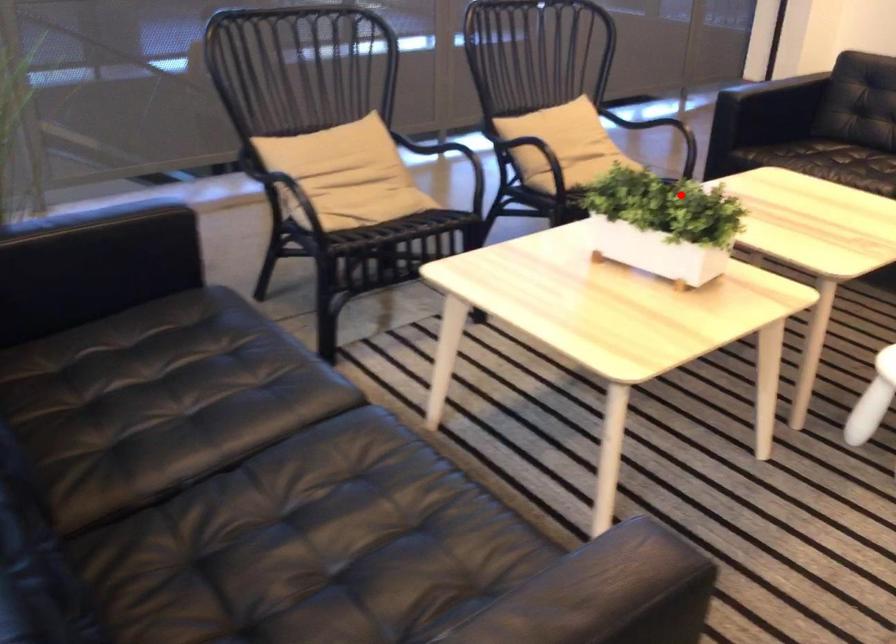
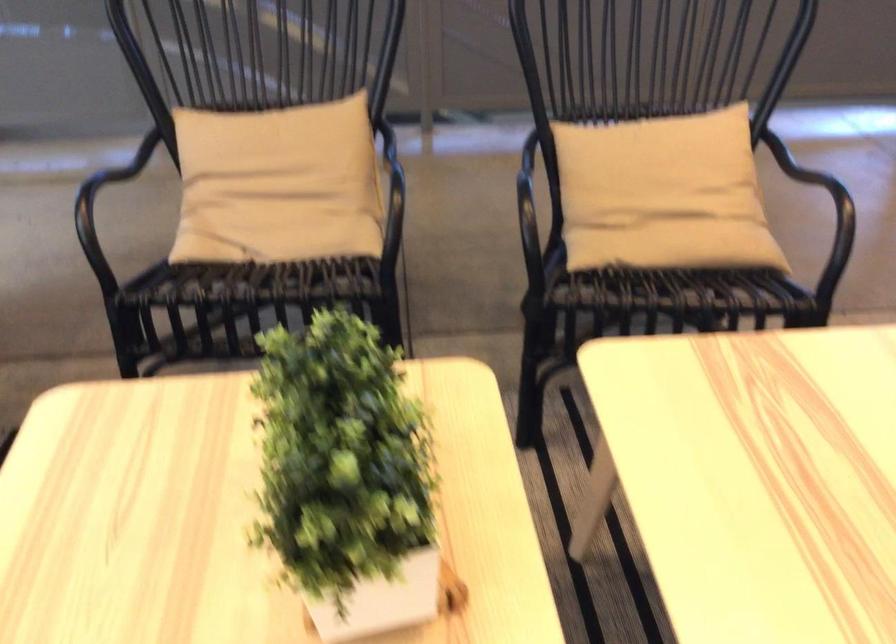
Question: I am providing you with two images of the same scene from different viewpoints. Given a red point in image1, look at the same physical point in image2. Is it:

Choices:
 (A) Closer to the viewpoint
 (B) Farther from the viewpoint

Answer: (A)